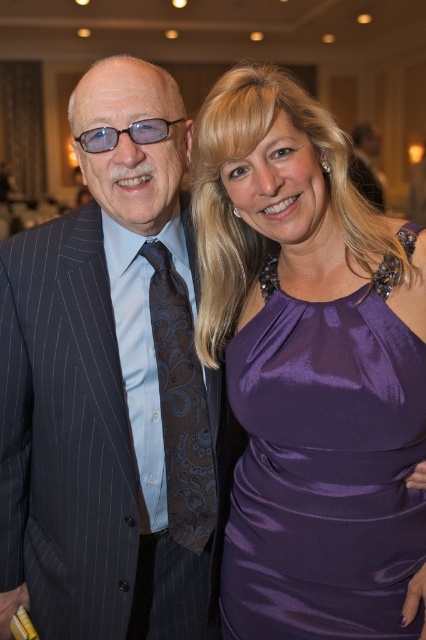
Between dark pinstripe suit at center and satin purple dress at right, which one appears on the right side from the viewer's perspective?

satin purple dress at right is more to the right.

Does dark pinstripe suit at center appear on the right side of satin purple dress at right?

No, dark pinstripe suit at center is not to the right of satin purple dress at right.

Does point (121, 212) come closer to viewer compared to point (284, 348)?

No, (121, 212) is further to viewer.

Where is `dark pinstripe suit at center`? Image resolution: width=426 pixels, height=640 pixels. dark pinstripe suit at center is located at coordinates (80, 397).

Can you confirm if matte black suit at left is taller than clear plastic glasses at upper left?

Correct, matte black suit at left is much taller as clear plastic glasses at upper left.

Between matte black suit at left and clear plastic glasses at upper left, which one has more height?

Standing taller between the two is matte black suit at left.

At what (x,y) coordinates should I click in order to perform the action: click on matte black suit at left. Please return your answer as a coordinate pair (x, y). Looking at the image, I should click on (365, 163).

Who is shorter, satin purple dress at right or clear plastic glasses at upper left?

clear plastic glasses at upper left

Does satin purple dress at right have a lesser width compared to clear plastic glasses at upper left?

In fact, satin purple dress at right might be wider than clear plastic glasses at upper left.

Where is `satin purple dress at right`? This screenshot has width=426, height=640. satin purple dress at right is located at coordinates click(x=325, y=467).